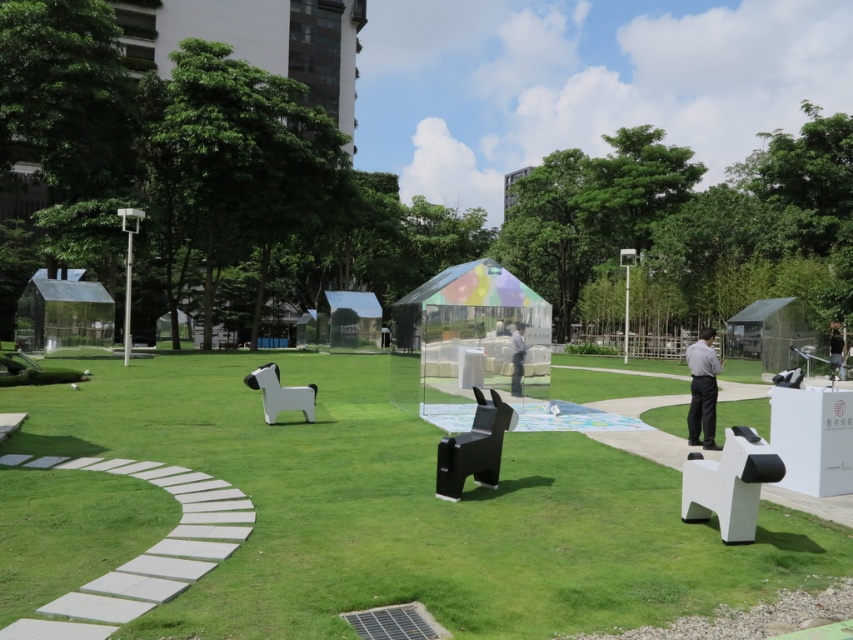
You are standing at the origin point in the art installation. Which direction should you walk to reach the white matte dog at center?

You should walk towards the point with coordinates of 0.798 in the x axis and 0.482 in the y axis to reach the white matte dog at center.